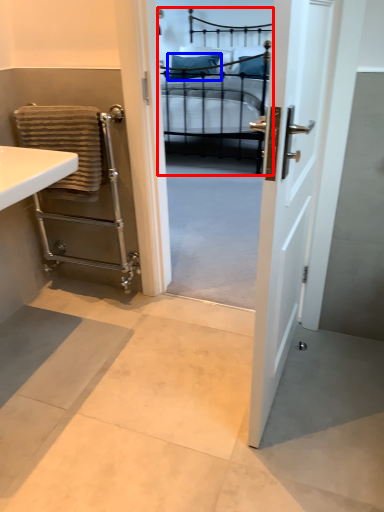
Question: Which point is closer to the camera, bed (highlighted by a red box) or pillow (highlighted by a blue box)?

Choices:
 (A) bed
 (B) pillow

Answer: (A)